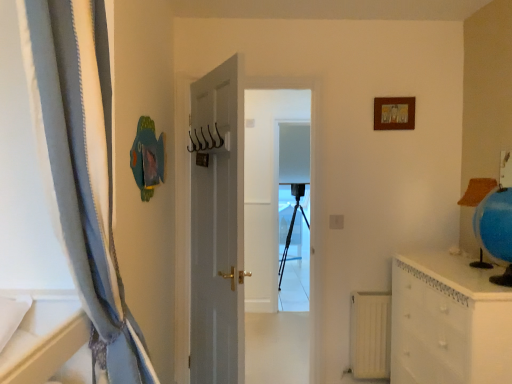
What do you see at coordinates (205, 140) in the screenshot? I see `metallic hooks at center` at bounding box center [205, 140].

The image size is (512, 384). In order to click on black matte tripod at center in this screenshot , I will do `click(293, 256)`.

The width and height of the screenshot is (512, 384). What do you see at coordinates (448, 322) in the screenshot?
I see `white glossy chest of drawers at right` at bounding box center [448, 322].

What is the approximate width of white glossy door at center?

The width of white glossy door at center is 2.79 inches.

Identify the location of blue fabric curtain at left. (82, 167).

Find the location of a particular element. metallic hooks at center is located at coordinates (205, 140).

Are metallic hooks at center and white matte radiator at lower right located far from each other?

Yes, metallic hooks at center is far from white matte radiator at lower right.

In the scene shown: From the image's perspective, which one is positioned higher, metallic hooks at center or white matte radiator at lower right?

Answer: From the image's view, metallic hooks at center is above.

Where is `radiator that appears below the metallic hooks at center (from the image's perspective)`? This screenshot has width=512, height=384. radiator that appears below the metallic hooks at center (from the image's perspective) is located at coordinates (370, 335).

Between metallic hooks at center and white matte radiator at lower right, which one appears on the right side from the viewer's perspective?

white matte radiator at lower right.

Is point (385, 345) in front of point (214, 144)?

No, (385, 345) is behind (214, 144).

Is white matte radiator at lower right shorter than metallic hooks at center?

No, white matte radiator at lower right is not shorter than metallic hooks at center.

In the scene shown: Is white matte radiator at lower right facing away from metallic hooks at center?

No, white matte radiator at lower right is not facing away from metallic hooks at center.

From the image's perspective, between white matte radiator at lower right and metallic hooks at center, who is located below?

white matte radiator at lower right appears lower in the image.

Does point (313, 331) appear closer or farther from the camera than point (84, 265)?

Point (313, 331).

In the scene shown: Is blue fabric curtain at left at the back of white glossy door at center?

No, blue fabric curtain at left is not at the back of white glossy door at center.

Are white glossy door at center and blue fabric curtain at left beside each other?

There is a gap between white glossy door at center and blue fabric curtain at left.

Which object is further away from the camera taking this photo, white glossy door at center or blue fabric curtain at left?

white glossy door at center is further from the camera.

From a real-world perspective, between white matte radiator at lower right and white glossy chest of drawers at right, who is vertically lower?

In real-world perspective, white matte radiator at lower right is lower.

Is white matte radiator at lower right directly adjacent to white glossy chest of drawers at right?

No, white matte radiator at lower right is not making contact with white glossy chest of drawers at right.

Looking at the image, does blue fabric curtain at left seem bigger or smaller compared to white glossy door at center?

Considering their sizes, blue fabric curtain at left takes up more space than white glossy door at center.

Is blue fabric curtain at left not close to white glossy door at center?

Absolutely, blue fabric curtain at left is distant from white glossy door at center.

Looking at this image, is blue fabric curtain at left inside the boundaries of white glossy door at center, or outside?

blue fabric curtain at left is not enclosed by white glossy door at center.

From a real-world perspective, which object rests below the other?

black matte tripod at center, from a real-world perspective.

Can you confirm if metallic hooks at center is positioned to the left of black matte tripod at center?

Indeed, metallic hooks at center is positioned on the left side of black matte tripod at center.

Which object is closer to the camera taking this photo, metallic hooks at center or black matte tripod at center?

Positioned in front is metallic hooks at center.

Is point (204, 136) positioned before point (293, 239)?

Yes, point (204, 136) is in front of point (293, 239).

Is blue fabric curtain at left next to white glossy chest of drawers at right?

No, blue fabric curtain at left is not next to white glossy chest of drawers at right.

Can you confirm if blue fabric curtain at left is thinner than white glossy chest of drawers at right?

Yes.

Which is in front, blue fabric curtain at left or white glossy chest of drawers at right?

blue fabric curtain at left is closer to the camera.

The height and width of the screenshot is (384, 512). In order to click on curtain positioned vertically above the white glossy chest of drawers at right (from a real-world perspective) in this screenshot , I will do `click(82, 167)`.

The width and height of the screenshot is (512, 384). I want to click on hanger above the white matte radiator at lower right (from the image's perspective), so click(205, 140).

This screenshot has width=512, height=384. Identify the location of radiator below the metallic hooks at center (from the image's perspective). (370, 335).

Estimate the real-world distances between objects in this image. Which object is closer to black matte tripod at center, metallic hooks at center or white glossy chest of drawers at right?

metallic hooks at center is closer to black matte tripod at center.

In the scene shown: From the image, which object appears to be farther from metallic hooks at center, white glossy door at center or blue fabric curtain at left?

blue fabric curtain at left is positioned further to the anchor metallic hooks at center.

From the image, which object appears to be farther from blue fabric curtain at left, black matte tripod at center or white glossy chest of drawers at right?

black matte tripod at center is positioned further to the anchor blue fabric curtain at left.

Consider the image. Based on their spatial positions, is white matte radiator at lower right or blue fabric curtain at left further from white glossy chest of drawers at right?

blue fabric curtain at left.

Estimate the real-world distances between objects in this image. Which object is closer to black matte tripod at center, white glossy door at center or metallic hooks at center?

The object closer to black matte tripod at center is white glossy door at center.

Which object lies nearer to the anchor point white glossy chest of drawers at right, metallic hooks at center or black matte tripod at center?

Based on the image, metallic hooks at center appears to be nearer to white glossy chest of drawers at right.

From the image, which object appears to be nearer to white matte radiator at lower right, white glossy chest of drawers at right or metallic hooks at center?

Based on the image, white glossy chest of drawers at right appears to be nearer to white matte radiator at lower right.

Which object lies nearer to the anchor point metallic hooks at center, blue fabric curtain at left or white glossy door at center?

white glossy door at center is closer to metallic hooks at center.

Locate an element on the screen. hanger positioned between blue fabric curtain at left and white glossy door at center from near to far is located at coordinates (205, 140).

Where is `screen door between metallic hooks at center and black matte tripod at center in the front-back direction`? screen door between metallic hooks at center and black matte tripod at center in the front-back direction is located at coordinates (311, 204).

Image resolution: width=512 pixels, height=384 pixels. What are the coordinates of `radiator between metallic hooks at center and black matte tripod at center along the z-axis` in the screenshot? It's located at (370, 335).

Identify the location of screen door positioned between white matte radiator at lower right and black matte tripod at center from near to far. (311, 204).